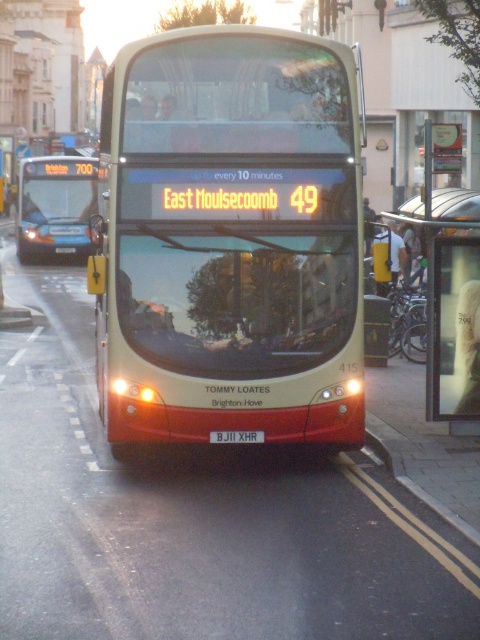
You are standing at the point marked by the coordinates point (x=450, y=300). What object are you standing on?

The point (x=450, y=300) corresponds to the transparent glass bus stop at center.

You are a delivery person carrying a box that is 2 meters wide. You need to pass through either the transparent glass bus stop at center or the metallic gray curb at lower right. Which one can you go through based on their widths?

The transparent glass bus stop at center is wider than the metallic gray curb at lower right. Since your box is 2 meters wide, you should choose the transparent glass bus stop at center as it can accommodate the width of your box.

Based on the photo, you are a delivery person who needs to load a tall package into your van. The transparent glass bus stop at center and the matte blue bus at left are blocking the path. Which object should you move to create more vertical space?

The transparent glass bus stop at center has a lesser height compared to the matte blue bus at left, so you should move the transparent glass bus stop at center to create more vertical space.